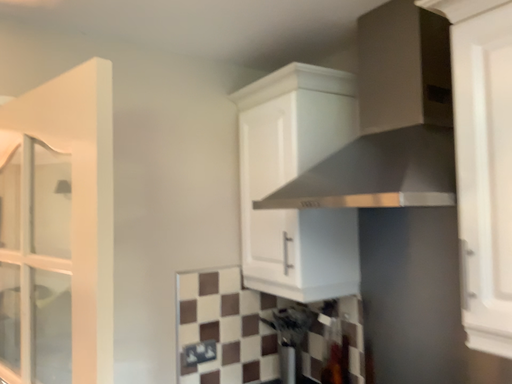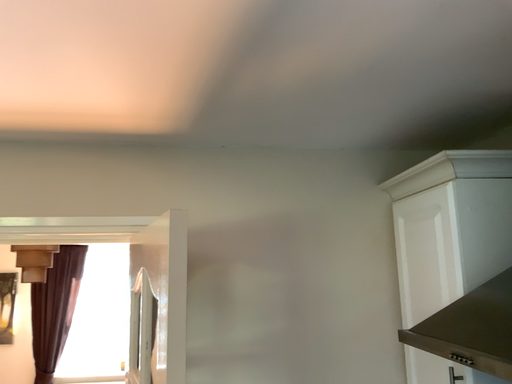
Question: How did the camera likely rotate when shooting the video?

Choices:
 (A) rotated left
 (B) rotated right

Answer: (A)